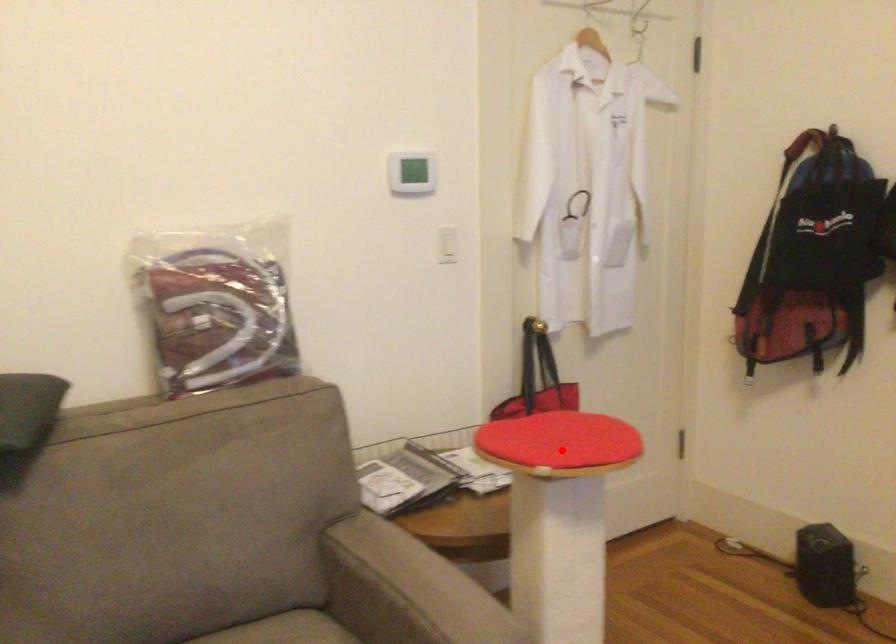
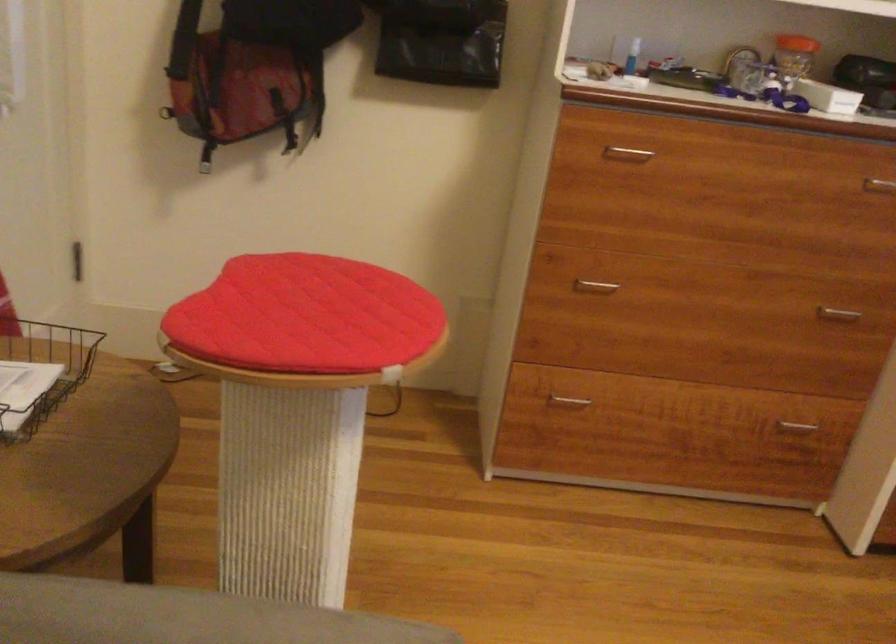
Question: I am providing you with two images of the same scene from different viewpoints. A red point is shown in image1. For the corresponding object point in image2, is it positioned nearer or farther from the camera?

Choices:
 (A) Nearer
 (B) Farther

Answer: (A)